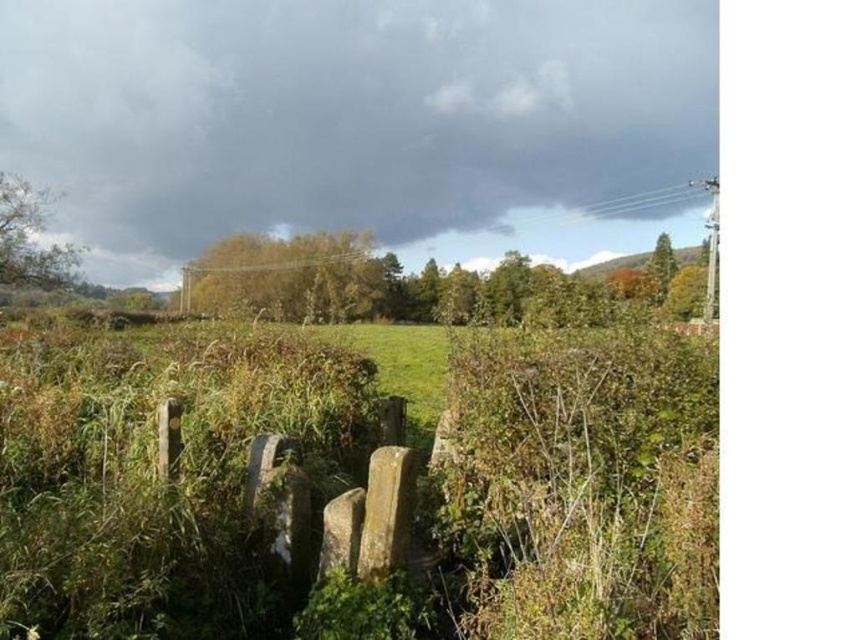
You are a bird flying over the rural landscape. You want to land on a tree that is closer to you. Which tree should you choose between the green leafy tree at center and the green leafy tree at upper right?

The green leafy tree at center is in front of the green leafy tree at upper right, so it is closer to you. You should choose the green leafy tree at center to land on.